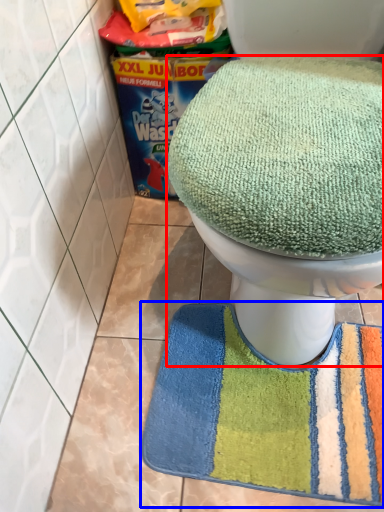
Question: Among these objects, which one is nearest to the camera, toilet (highlighted by a red box) or bath mat (highlighted by a blue box)?

Choices:
 (A) toilet
 (B) bath mat

Answer: (A)